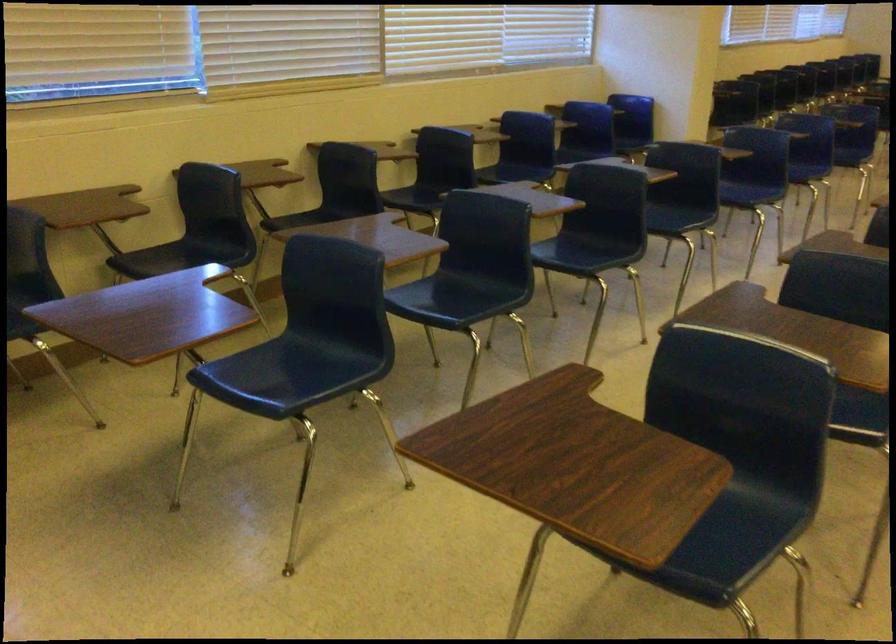
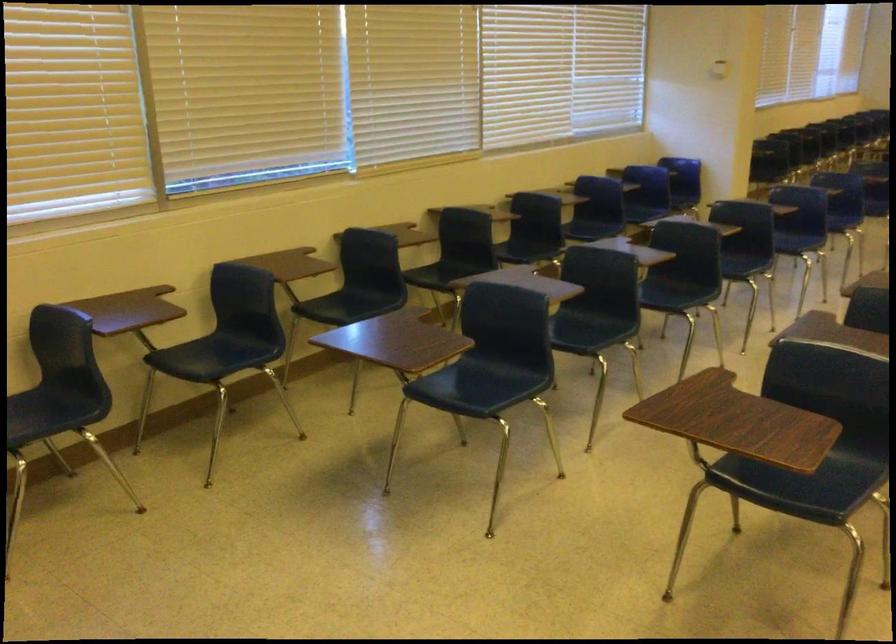
Where in the second image is the point corresponding to point (280, 379) from the first image?

(467, 386)